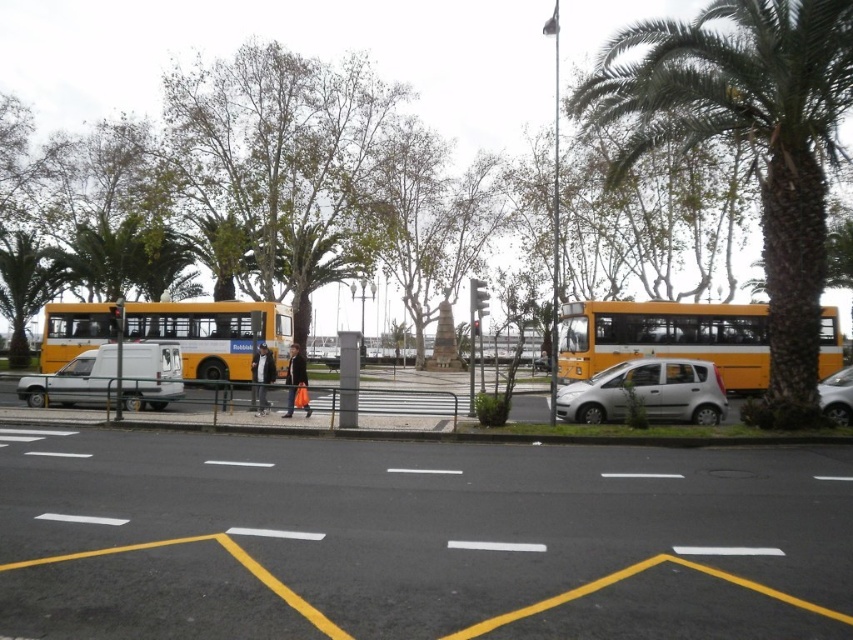
Is point (189, 634) farther from camera compared to point (749, 52)?

That is False.

Is point (625, 534) positioned in front of point (776, 230)?

Yes, point (625, 534) is in front of point (776, 230).

You are a GUI agent. You are given a task and a screenshot of the screen. Output one action in this format:
    pyautogui.click(x=<x>, y=<y>)
    Task: Click on the yellow asphalt parking lot at center
    Image resolution: width=853 pixels, height=640 pixels.
    Given the screenshot: What is the action you would take?
    pyautogui.click(x=419, y=540)

Does point (276, 499) come farther from viewer compared to point (846, 368)?

No, (276, 499) is in front of (846, 368).

Which is above, yellow asphalt parking lot at center or silver metallic sedan at right?

A: silver metallic sedan at right is higher up.

This screenshot has width=853, height=640. Describe the element at coordinates (419, 540) in the screenshot. I see `yellow asphalt parking lot at center` at that location.

This screenshot has width=853, height=640. Find the location of `yellow asphalt parking lot at center`. yellow asphalt parking lot at center is located at coordinates click(419, 540).

What do you see at coordinates (665, 337) in the screenshot?
I see `yellow matte bus at right` at bounding box center [665, 337].

Is yellow matte bus at right shorter than silver metallic van at left?

Incorrect, yellow matte bus at right's height does not fall short of silver metallic van at left's.

Locate an element on the screen. The image size is (853, 640). yellow matte bus at right is located at coordinates tap(665, 337).

You are a GUI agent. You are given a task and a screenshot of the screen. Output one action in this format:
    pyautogui.click(x=<x>, y=<y>)
    Task: Click on the yellow matte bus at right
    The height and width of the screenshot is (640, 853).
    Given the screenshot: What is the action you would take?
    pyautogui.click(x=665, y=337)